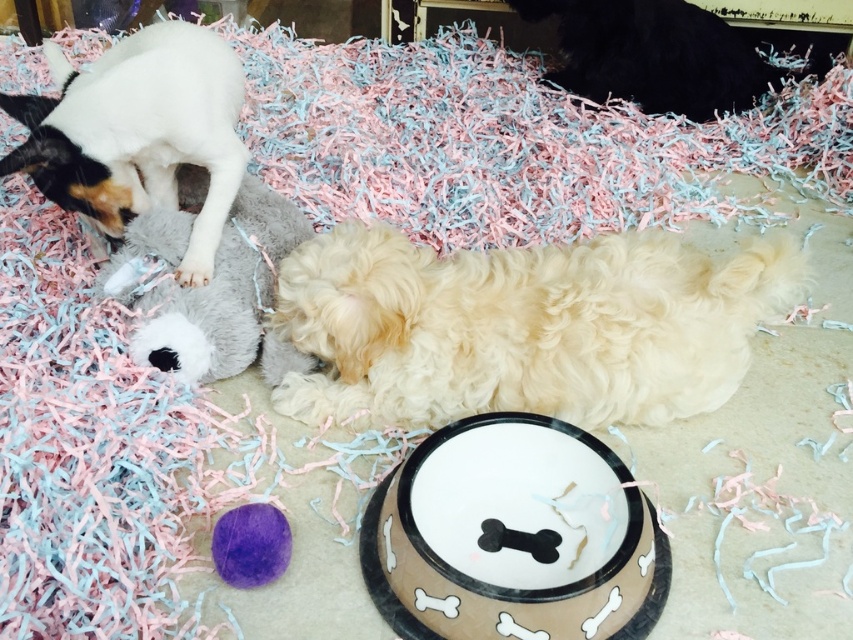
You are a pet owner who wants to place a new rectangular pet bed in the living room. The bed is 1.2 meters wide. You see the white fluffy dog at center and the brown ceramic bowl at center. Which object is wider, and will the pet bed fit between them if placed there?

The white fluffy dog at center is wider than the brown ceramic bowl at center. Since the pet bed is 1.2 meters wide, it depends on the actual distance between them. However, the description only provides relative width information between the objects, not the space between them. Therefore, we cannot determine if the pet bed will fit based on the given information.

You are a pet sitter who needs to reach the plush bunny toy for the white fluffy dog at center. You are standing 1.5 meters away from the dog. Can you safely hand the toy to the dog without needing to move closer than 1.42 meters?

The distance of white fluffy dog at center from viewer is 1.42 meters, so yes, you can safely hand the toy to the white fluffy dog at center without needing to move closer than that distance since you are already within the required proximity.

You are a small dog who wants to reach both the brown ceramic bowl at center and the white soft plush toy at upper left. Which object is shorter and easier for you to see over?

The brown ceramic bowl at center is shorter than the white soft plush toy at upper left, so it is easier for the dog to see over.